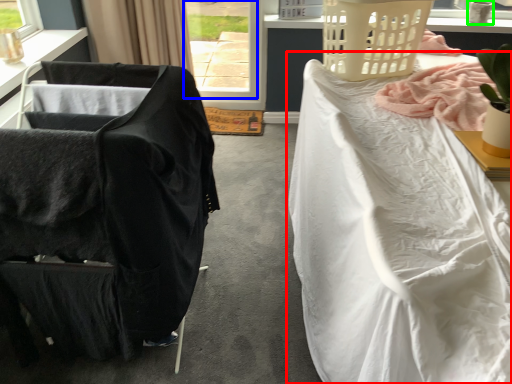
Question: Based on their relative distances, which object is farther from bed (highlighted by a red box)? Choose from window (highlighted by a blue box) and lamp (highlighted by a green box).

Choices:
 (A) window
 (B) lamp

Answer: (A)